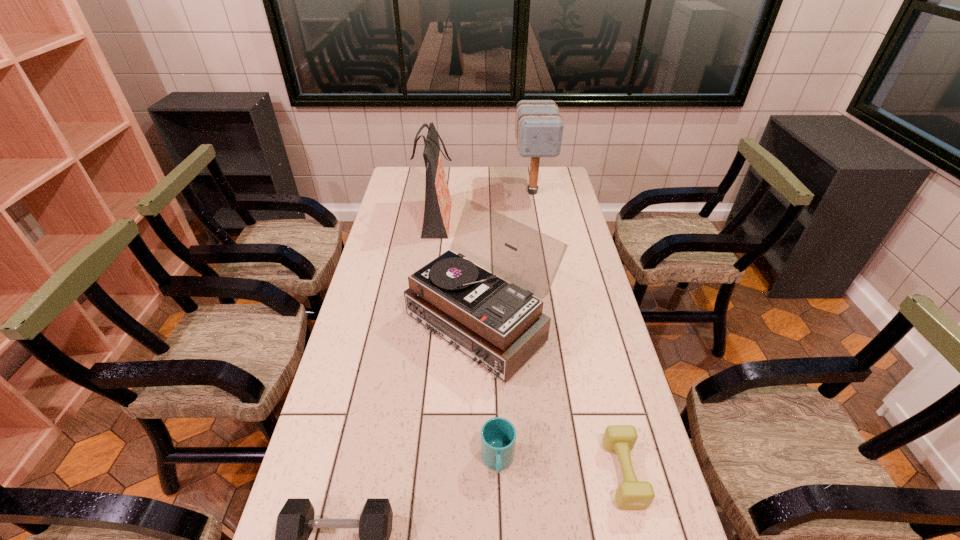
In the image, there is a desktop. Identify the location of free region at the far right corner. The image size is (960, 540). (568, 180).

What are the coordinates of `free spot between the cup and the record player` in the screenshot? It's located at (490, 391).

The width and height of the screenshot is (960, 540). What are the coordinates of `vacant point located between the fourth nearest object and the shortest object` in the screenshot? It's located at (553, 397).

The image size is (960, 540). I want to click on vacant area between the farther dumbbell and the cup, so click(561, 467).

This screenshot has width=960, height=540. Identify the location of free spot between the record player and the cup. (490, 391).

At what (x,y) coordinates should I click in order to perform the action: click on object that is the fifth closest to the shopping bag. Please return your answer as a coordinate pair (x, y). The width and height of the screenshot is (960, 540). Looking at the image, I should click on (295, 522).

Where is `object that is the fourth closest to the mallet`? The height and width of the screenshot is (540, 960). object that is the fourth closest to the mallet is located at coordinates (498, 435).

Where is `free space that satisfies the following two spatial constraints: 1. on the front side of the shorter dumbbell; 2. on the right side of the shopping bag`? free space that satisfies the following two spatial constraints: 1. on the front side of the shorter dumbbell; 2. on the right side of the shopping bag is located at coordinates (401, 473).

Find the location of a particular element. The height and width of the screenshot is (540, 960). blank space that satisfies the following two spatial constraints: 1. on the striking surface of the shorter dumbbell; 2. on the right side of the mallet is located at coordinates (582, 473).

Identify the location of vacant space that satisfies the following two spatial constraints: 1. on the handle side of the shorter dumbbell; 2. on the right side of the cup. This screenshot has width=960, height=540. (498, 473).